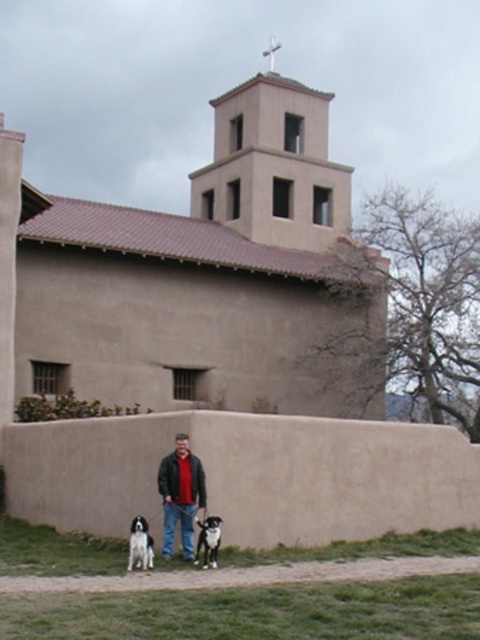
You are a photographer trying to capture the man in the scene. Since you want to focus on the dark gray jacket at center and the black and white fur at lower center, which object should you zoom in on to ensure both are clearly visible in the frame?

The dark gray jacket at center is bigger than the black and white fur at lower center, so you should zoom in on the dark gray jacket at center to ensure both are clearly visible in the frame.

You are the man in the image. You want to reach your white fur dog at lower left to give it a treat. Which direction should you move relative to your dark gray jacket at center?

You should move to the left relative to your dark gray jacket at center because the white fur dog at lower left is to the left of the jacket.

You are a photographer taking a picture of the church. You notice the dark gray jacket at center and the white fur dog at lower left. Which object should you focus on first to ensure both are in the frame?

You should focus on the dark gray jacket at center first because it is positioned over the white fur dog at lower left, meaning it is closer to the camera and would be the primary subject in the frame.